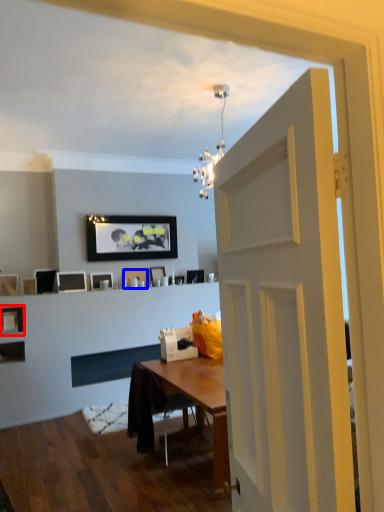
Question: Among these objects, which one is farthest to the camera, picture frame (highlighted by a red box) or picture frame (highlighted by a blue box)?

Choices:
 (A) picture frame
 (B) picture frame

Answer: (B)